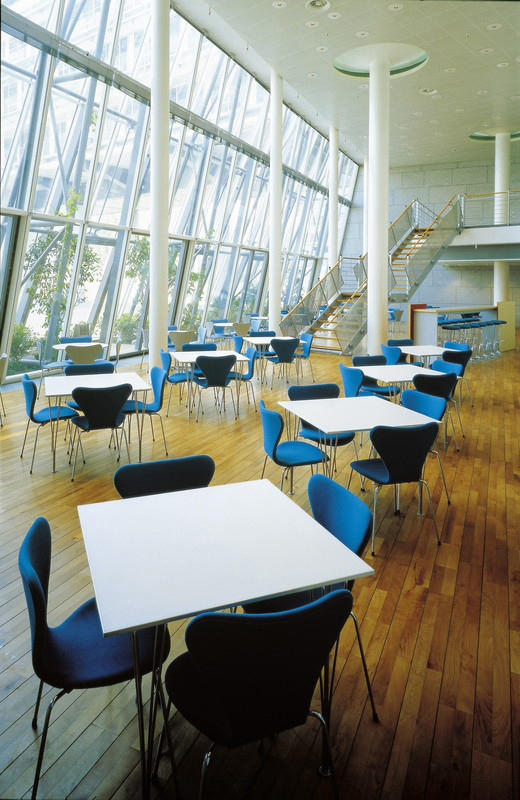
At what (x,y) coordinates should I click in order to perform the action: click on table. Please return your answer as a coordinate pair (x, y). Looking at the image, I should click on (181, 582), (119, 380), (84, 340), (196, 357), (258, 342), (219, 325), (260, 316), (341, 422), (391, 366), (424, 350).